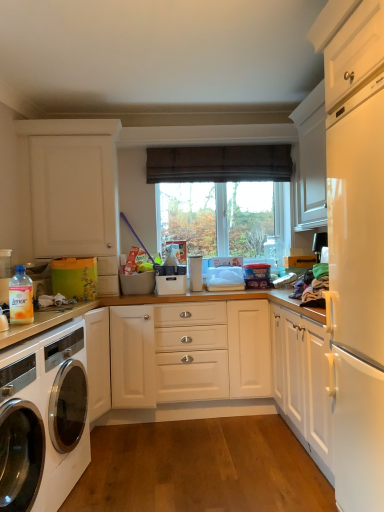
Question: Can you confirm if transparent glass window at center is shorter than brown fabric curtain at center?

Choices:
 (A) no
 (B) yes

Answer: (A)

Question: Is transparent glass window at center at the left side of brown fabric curtain at center?

Choices:
 (A) no
 (B) yes

Answer: (A)

Question: Is transparent glass window at center not close to brown fabric curtain at center?

Choices:
 (A) no
 (B) yes

Answer: (A)

Question: Is transparent glass window at center turned away from brown fabric curtain at center?

Choices:
 (A) no
 (B) yes

Answer: (A)

Question: Is transparent glass window at center outside brown fabric curtain at center?

Choices:
 (A) no
 (B) yes

Answer: (B)

Question: Is transparent glass window at center bigger than brown fabric curtain at center?

Choices:
 (A) no
 (B) yes

Answer: (B)

Question: Is brown fabric curtain at center oriented towards white glossy washing machine at lower left?

Choices:
 (A) yes
 (B) no

Answer: (B)

Question: Is brown fabric curtain at center positioned before white glossy washing machine at lower left?

Choices:
 (A) yes
 (B) no

Answer: (B)

Question: From a real-world perspective, is brown fabric curtain at center physically below white glossy washing machine at lower left?

Choices:
 (A) no
 (B) yes

Answer: (A)

Question: Is white glossy washing machine at lower left a part of brown fabric curtain at center?

Choices:
 (A) yes
 (B) no

Answer: (B)

Question: From a real-world perspective, is brown fabric curtain at center positioned over white glossy washing machine at lower left based on gravity?

Choices:
 (A) yes
 (B) no

Answer: (A)

Question: Considering the relative positions of brown fabric curtain at center and white glossy washing machine at lower left in the image provided, is brown fabric curtain at center to the right of white glossy washing machine at lower left from the viewer's perspective?

Choices:
 (A) no
 (B) yes

Answer: (B)

Question: From a real-world perspective, is transparent glass window at center on white glossy washing machine at lower left?

Choices:
 (A) yes
 (B) no

Answer: (A)